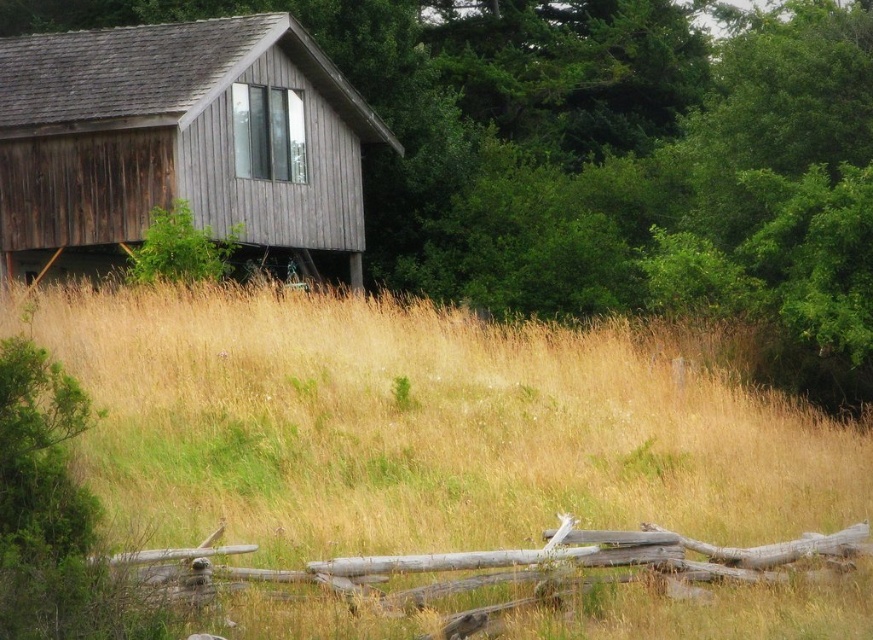
Does green leafy tree at upper center appear on the left side of weathered wood cabin at upper left?

Incorrect, green leafy tree at upper center is not on the left side of weathered wood cabin at upper left.

Is point (725, 177) closer to viewer compared to point (129, 212)?

That is False.

Locate an element on the screen. This screenshot has width=873, height=640. green leafy tree at upper center is located at coordinates (607, 157).

Is dry grass at center shorter than green leafy tree at upper center?

Yes.

What do you see at coordinates (418, 428) in the screenshot? I see `dry grass at center` at bounding box center [418, 428].

At what (x,y) coordinates should I click in order to perform the action: click on dry grass at center. Please return your answer as a coordinate pair (x, y). Looking at the image, I should click on (418, 428).

Where is `dry grass at center`? The image size is (873, 640). dry grass at center is located at coordinates click(418, 428).

Does dry grass at center appear under weathered wood cabin at upper left?

Indeed, dry grass at center is positioned under weathered wood cabin at upper left.

Does dry grass at center have a lesser height compared to weathered wood cabin at upper left?

Yes, dry grass at center is shorter than weathered wood cabin at upper left.

Which is behind, point (101, 392) or point (56, 36)?

The point (56, 36) is more distant.

Where is `dry grass at center`? This screenshot has height=640, width=873. dry grass at center is located at coordinates (418, 428).